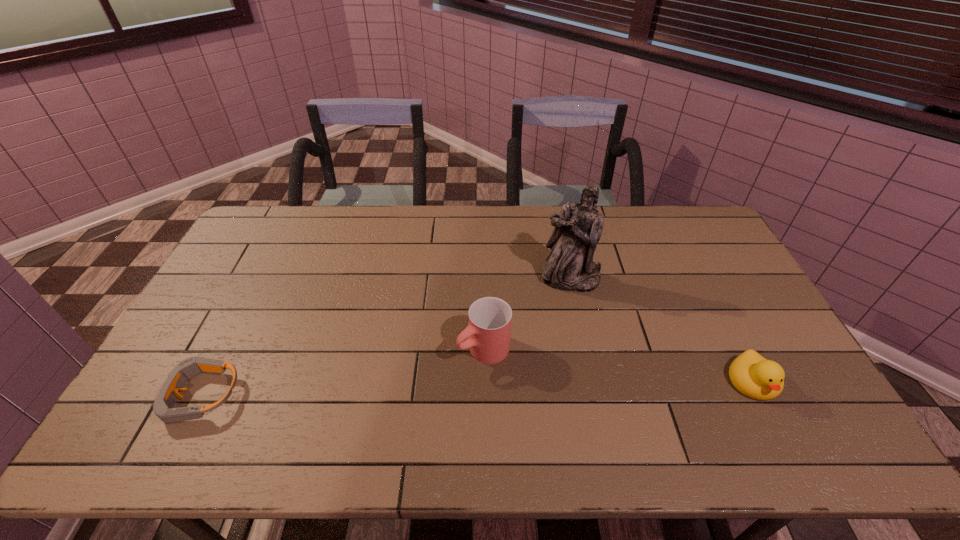
This screenshot has width=960, height=540. In the image, there is a desktop. In order to click on blank space at the near edge in this screenshot , I will do `click(602, 403)`.

This screenshot has width=960, height=540. I want to click on vacant space at the left edge of the desktop, so click(194, 347).

The image size is (960, 540). Identify the location of vacant space at the right edge of the desktop. (706, 252).

You are a GUI agent. You are given a task and a screenshot of the screen. Output one action in this format:
    pyautogui.click(x=<x>, y=<y>)
    Task: Click on the free location at the far left corner of the desktop
    The image size is (960, 540).
    Given the screenshot: What is the action you would take?
    pyautogui.click(x=286, y=208)

In the image, there is a desktop. Where is `vacant space at the far right corner`? This screenshot has width=960, height=540. vacant space at the far right corner is located at coordinates (710, 230).

Find the location of `unoccupied position between the second object from right to left and the duckling`. unoccupied position between the second object from right to left and the duckling is located at coordinates (662, 330).

I want to click on vacant space that is in between the shortest object and the farthest object, so pyautogui.click(x=386, y=338).

The height and width of the screenshot is (540, 960). Find the location of `vacant point located between the third object from left to right and the goggles`. vacant point located between the third object from left to right and the goggles is located at coordinates (386, 338).

Locate an element on the screen. This screenshot has width=960, height=540. blank region between the second object from right to left and the rightmost object is located at coordinates (662, 330).

This screenshot has width=960, height=540. Find the location of `blank region between the second object from left to right and the shortest object`. blank region between the second object from left to right and the shortest object is located at coordinates (342, 373).